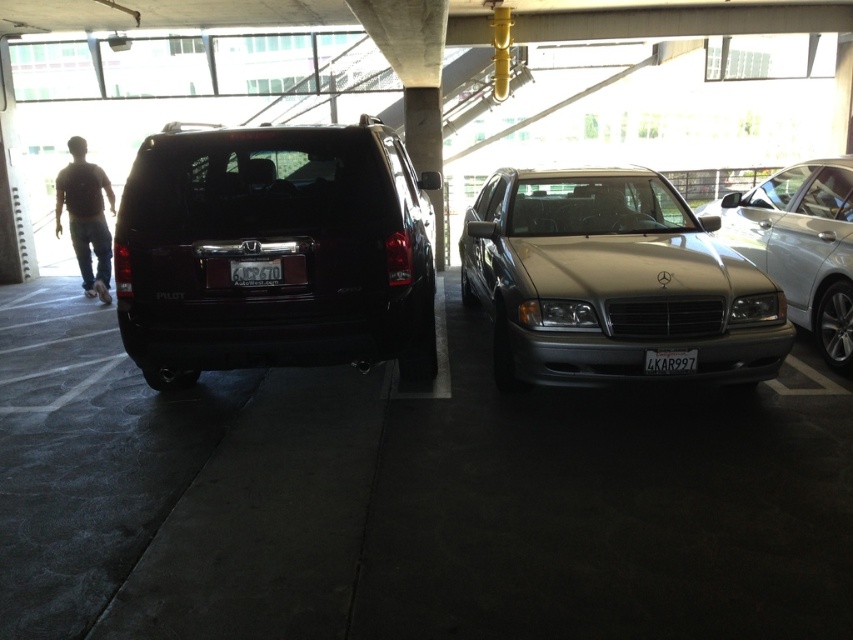
Question: Is satin silver sedan at center below silver metallic sedan at center?

Choices:
 (A) yes
 (B) no

Answer: (A)

Question: Can you confirm if black matte suv at center is positioned above satin silver sedan at center?

Choices:
 (A) no
 (B) yes

Answer: (A)

Question: Is silver metallic sedan at center wider than black plastic license plate at center?

Choices:
 (A) yes
 (B) no

Answer: (A)

Question: Which of the following is the closest to the observer?

Choices:
 (A) satin silver sedan at center
 (B) brown cotton shirt at left
 (C) red plastic license plate at rear center

Answer: (C)

Question: Which object is the farthest from the black matte suv at center?

Choices:
 (A) satin silver sedan at center
 (B) black plastic license plate at center

Answer: (A)

Question: Which of the following is the farthest from the observer?

Choices:
 (A) (756, 196)
 (B) (97, 276)
 (C) (252, 269)

Answer: (B)